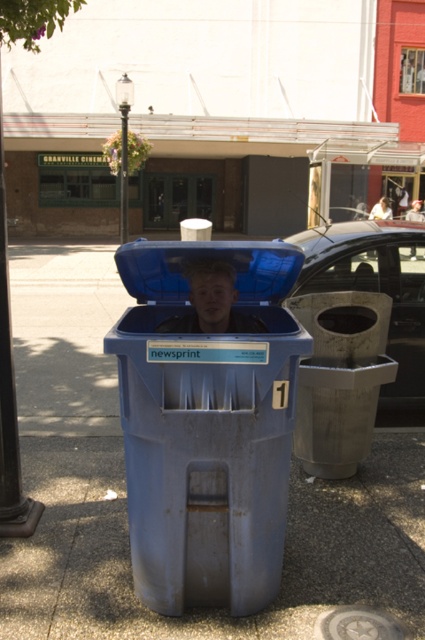
Is point (56, 522) more distant than point (0, 451)?

Yes, it is behind point (0, 451).

Can you confirm if gray concrete pavement at lower center is bigger than black polished pole at upper left?

Indeed, gray concrete pavement at lower center has a larger size compared to black polished pole at upper left.

The image size is (425, 640). What do you see at coordinates (212, 609) in the screenshot?
I see `gray concrete pavement at lower center` at bounding box center [212, 609].

You are a GUI agent. You are given a task and a screenshot of the screen. Output one action in this format:
    pyautogui.click(x=<x>, y=<y>)
    Task: Click on the gray concrete pavement at lower center
    
    Given the screenshot: What is the action you would take?
    pyautogui.click(x=212, y=609)

Which is behind, point (314, 460) or point (17, 442)?

The point (314, 460) is behind.

Between rusty metal trash can at center and black polished pole at upper left, which one is positioned lower?

rusty metal trash can at center is lower down.

Consider the image. Who is more forward, (325, 372) or (10, 36)?

Point (10, 36) is in front.

Where is `rusty metal trash can at center`? rusty metal trash can at center is located at coordinates (340, 378).

Which is in front, point (331, 529) or point (373, 305)?

Point (331, 529) is more forward.

Can you confirm if gray concrete pavement at lower center is shorter than rusty metal trash can at center?

Indeed, gray concrete pavement at lower center has a lesser height compared to rusty metal trash can at center.

You are a GUI agent. You are given a task and a screenshot of the screen. Output one action in this format:
    pyautogui.click(x=<x>, y=<y>)
    Task: Click on the gray concrete pavement at lower center
    The width and height of the screenshot is (425, 640).
    Given the screenshot: What is the action you would take?
    pyautogui.click(x=212, y=609)